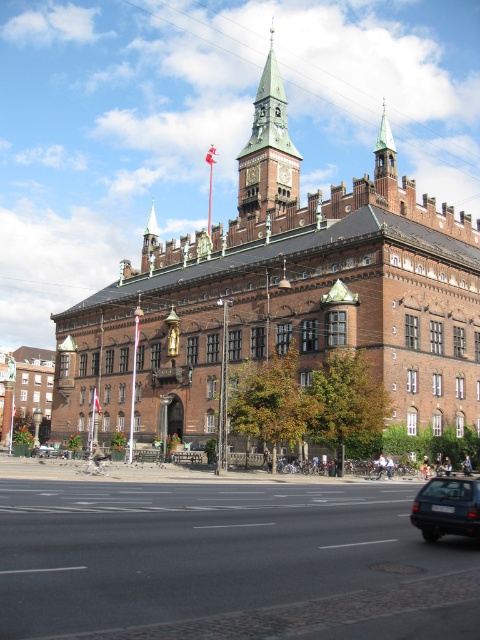
Question: Among these points, which one is nearest to the camera?

Choices:
 (A) (458, 512)
 (B) (240, 193)
 (C) (36, 449)

Answer: (A)

Question: Can you confirm if blue metallic car at lower right is smaller than metallic silver car at center?

Choices:
 (A) no
 (B) yes

Answer: (B)

Question: Does green copper tower at upper center lie behind metallic silver car at center?

Choices:
 (A) yes
 (B) no

Answer: (B)

Question: Where is green copper tower at upper center located in relation to metallic silver car at center in the image?

Choices:
 (A) left
 (B) right

Answer: (B)

Question: Which object is closer to the camera taking this photo?

Choices:
 (A) green copper clock tower at upper center
 (B) blue metallic car at lower right
 (C) metallic silver car at center

Answer: (B)

Question: Which is nearer to the green copper clock tower at upper center?

Choices:
 (A) metallic silver car at center
 (B) green copper tower at upper center

Answer: (B)